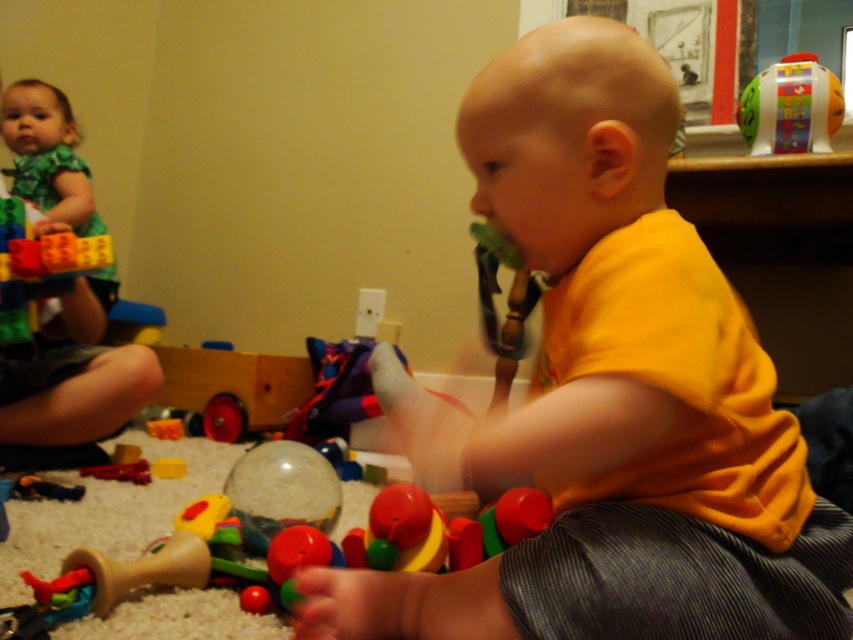
Is plastic abc book at upper right positioned behind wooden toy at center?

Yes, plastic abc book at upper right is further from the viewer.

Is point (738, 102) closer to camera compared to point (36, 493)?

No, it is not.

What are the coordinates of `plastic abc book at upper right` in the screenshot? It's located at (790, 108).

Who is higher up, yellow matte shirt at center or green fabric dress at upper left?

Positioned higher is green fabric dress at upper left.

The image size is (853, 640). What do you see at coordinates (608, 396) in the screenshot?
I see `yellow matte shirt at center` at bounding box center [608, 396].

Identify the location of yellow matte shirt at center. (608, 396).

Can you confirm if yellow matte shirt at center is smaller than plastic abc book at upper right?

Incorrect, yellow matte shirt at center is not smaller in size than plastic abc book at upper right.

Can you confirm if yellow matte shirt at center is shorter than plastic abc book at upper right?

No, yellow matte shirt at center is not shorter than plastic abc book at upper right.

Identify the location of yellow matte shirt at center. The height and width of the screenshot is (640, 853). (608, 396).